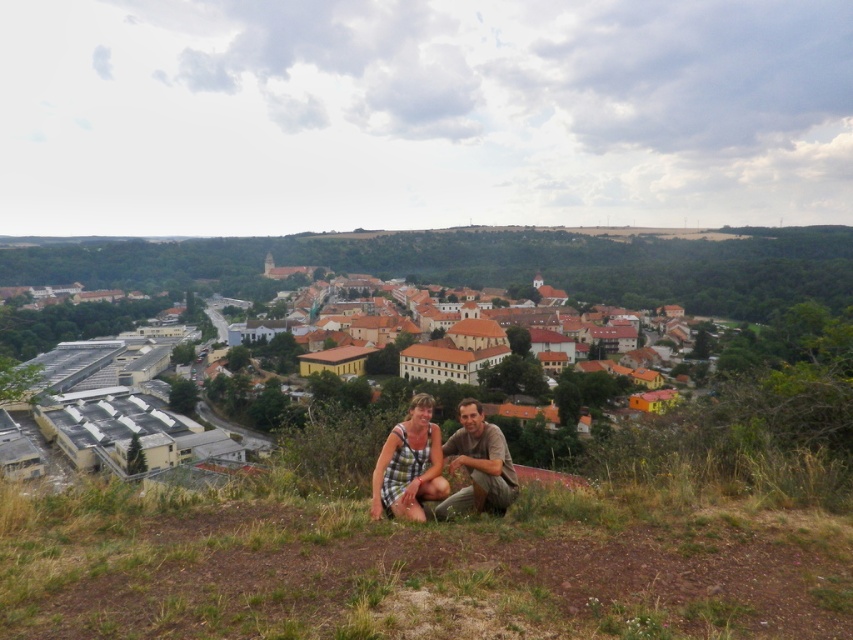
Question: Which point is closer to the camera?

Choices:
 (A) plaid fabric couple at center
 (B) brown tiled roofs at center

Answer: (A)

Question: Can you confirm if brown tiled roofs at center is bigger than plaid fabric couple at center?

Choices:
 (A) no
 (B) yes

Answer: (B)

Question: Is brown tiled roofs at center to the left of plaid fabric couple at center from the viewer's perspective?

Choices:
 (A) yes
 (B) no

Answer: (A)

Question: Is brown tiled roofs at center positioned in front of plaid fabric couple at center?

Choices:
 (A) yes
 (B) no

Answer: (B)